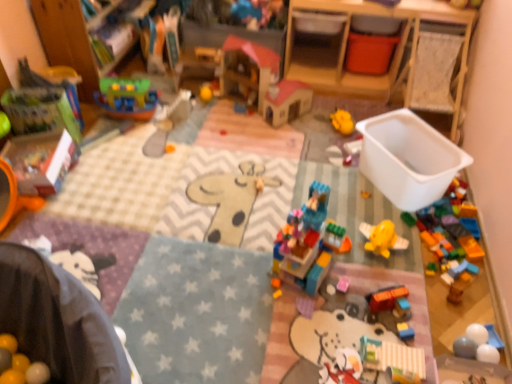
At what (x,y) coordinates should I click in order to perform the action: click on free space that is in between orange matte car at center, the 2th toy from the bottom, and translucent plastic boat at upper left, the 4th toy viewed from the top. Please return your answer as a coordinate pair (x, y). Looking at the image, I should click on (214, 178).